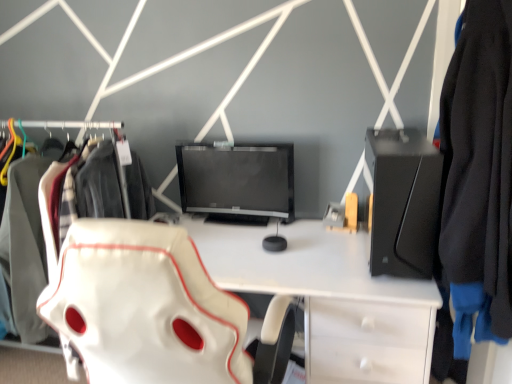
Describe the element at coordinates (403, 202) in the screenshot. I see `black matte desktop at right` at that location.

The height and width of the screenshot is (384, 512). In order to click on matte black monitor at center in this screenshot , I will do `click(237, 181)`.

Describe the element at coordinates (330, 298) in the screenshot. I see `white leather desk at center` at that location.

Locate an element on the screen. white leather swivel chair at center is located at coordinates (152, 310).

You are a GUI agent. You are given a task and a screenshot of the screen. Output one action in this format:
    pyautogui.click(x=<x>, y=<y>)
    Task: Click on the black matte desktop at right
    Image resolution: width=512 pixels, height=384 pixels.
    Given the screenshot: What is the action you would take?
    pyautogui.click(x=403, y=202)

Can you tell me how much white leather desk at center and black matte desktop at right differ in facing direction?

The angular difference between white leather desk at center and black matte desktop at right is 3.22 degrees.

From a real-world perspective, is white leather desk at center physically located above or below black matte desktop at right?

white leather desk at center is situated lower than black matte desktop at right in the real world.

Does white leather desk at center have a greater height compared to black matte desktop at right?

Yes.

Is white leather desk at center closer to camera compared to black matte desktop at right?

No, white leather desk at center is further to the viewer.

Looking at this image, how many degrees apart are the facing directions of white leather swivel chair at center and white leather desk at center?

The angular difference between white leather swivel chair at center and white leather desk at center is 178 degrees.

Does point (149, 318) come closer to viewer compared to point (294, 222)?

Yes.

The image size is (512, 384). In order to click on swivel chair above the white leather desk at center (from the image's perspective) in this screenshot , I will do `click(152, 310)`.

Is point (336, 293) in front of point (25, 176)?

Yes, it is.

Would you say white leather desk at center is inside or outside white fabric bag at left?

The correct answer is: outside.

From a real-world perspective, is white leather desk at center located higher than white fabric bag at left?

No, from a real-world perspective, white leather desk at center is not on top of white fabric bag at left.

Find the location of a particular element. desk that is below the white fabric bag at left (from the image's perspective) is located at coordinates (330, 298).

Considering the positions of objects matte black monitor at center and white fabric bag at left in the image provided, who is behind, matte black monitor at center or white fabric bag at left?

matte black monitor at center.

Between matte black monitor at center and white fabric bag at left, which one has more height?

white fabric bag at left is taller.

Is there a large distance between matte black monitor at center and white fabric bag at left?

No, there isn't a large distance between matte black monitor at center and white fabric bag at left.

Is matte black monitor at center to the left or to the right of white fabric bag at left in the image?

Based on their positions, matte black monitor at center is located to the right of white fabric bag at left.

From the image's perspective, which object appears higher, matte black monitor at center or white leather desk at center?

matte black monitor at center is shown above in the image.

In the image, there is a matte black monitor at center. At what (x,y) coordinates should I click in order to perform the action: click on desk below it (from the image's perspective). Please return your answer as a coordinate pair (x, y). The image size is (512, 384). Looking at the image, I should click on (330, 298).

Is matte black monitor at center behind white leather desk at center?

Yes, matte black monitor at center is further from the viewer.

From a real-world perspective, is black matte desktop at right positioned above or below white leather swivel chair at center?

In terms of real-world spatial position, black matte desktop at right is above white leather swivel chair at center.

Is white leather swivel chair at center located within black matte desktop at right?

No, black matte desktop at right does not contain white leather swivel chair at center.

Is point (414, 249) in front of point (131, 282)?

No, (414, 249) is behind (131, 282).

Who is more distant, black matte desktop at right or white leather swivel chair at center?

black matte desktop at right is more distant.

Considering the positions of points (26, 337) and (284, 147), is point (26, 337) farther from camera compared to point (284, 147)?

Yes, it is behind point (284, 147).

Can you confirm if white fabric bag at left is positioned to the right of matte black monitor at center?

A: In fact, white fabric bag at left is to the left of matte black monitor at center.

Is white fabric bag at left facing away from matte black monitor at center?

That's not correct — white fabric bag at left is not looking away from matte black monitor at center.

Consider the image. Considering the sizes of white fabric bag at left and matte black monitor at center in the image, is white fabric bag at left taller or shorter than matte black monitor at center?

white fabric bag at left is taller than matte black monitor at center.

Where is `desktop on the right side of white leather desk at center`? The height and width of the screenshot is (384, 512). desktop on the right side of white leather desk at center is located at coordinates (403, 202).

Locate an element on the screen. swivel chair above the white leather desk at center (from the image's perspective) is located at coordinates (152, 310).

In the scene shown: Estimate the real-world distances between objects in this image. Which object is further from black matte desktop at right, matte black monitor at center or white leather swivel chair at center?

matte black monitor at center lies further to black matte desktop at right than the other object.

Based on their spatial positions, is white leather swivel chair at center or black matte desktop at right closer to white fabric bag at left?

white leather swivel chair at center lies closer to white fabric bag at left than the other object.

Based on their spatial positions, is white leather desk at center or black fabric jacket at right further from matte black monitor at center?

black fabric jacket at right.

Looking at the image, which one is located closer to white fabric bag at left, white leather desk at center or matte black monitor at center?

matte black monitor at center is closer to white fabric bag at left.

Looking at the image, which one is located further to white leather desk at center, black matte desktop at right or white leather swivel chair at center?

Based on the image, white leather swivel chair at center appears to be further to white leather desk at center.

Estimate the real-world distances between objects in this image. Which object is further from white fabric bag at left, white leather desk at center or black fabric jacket at right?

The object further to white fabric bag at left is black fabric jacket at right.

From the picture: When comparing their distances from white leather desk at center, does black matte desktop at right or matte black monitor at center seem further?

Based on the image, matte black monitor at center appears to be further to white leather desk at center.

Considering their positions, is black fabric jacket at right positioned closer to white leather swivel chair at center than black matte desktop at right?

black matte desktop at right is closer to white leather swivel chair at center.

This screenshot has height=384, width=512. In order to click on computer monitor between white fabric bag at left and white leather desk at center from left to right in this screenshot , I will do `click(237, 181)`.

You are a GUI agent. You are given a task and a screenshot of the screen. Output one action in this format:
    pyautogui.click(x=<x>, y=<y>)
    Task: Click on the computer monitor between white fabric bag at left and black matte desktop at right in the horizontal direction
    The height and width of the screenshot is (384, 512).
    Given the screenshot: What is the action you would take?
    click(x=237, y=181)

Locate an element on the screen. The width and height of the screenshot is (512, 384). desktop between white leather swivel chair at center and matte black monitor at center along the z-axis is located at coordinates (403, 202).

Where is `desktop between black fabric jacket at right and white leather desk at center in the up-down direction`? The width and height of the screenshot is (512, 384). desktop between black fabric jacket at right and white leather desk at center in the up-down direction is located at coordinates (403, 202).